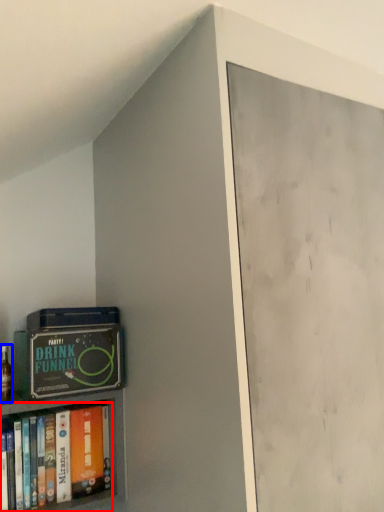
Question: Which object appears farthest to the camera in this image, book (highlighted by a red box) or alcohol (highlighted by a blue box)?

Choices:
 (A) book
 (B) alcohol

Answer: (B)